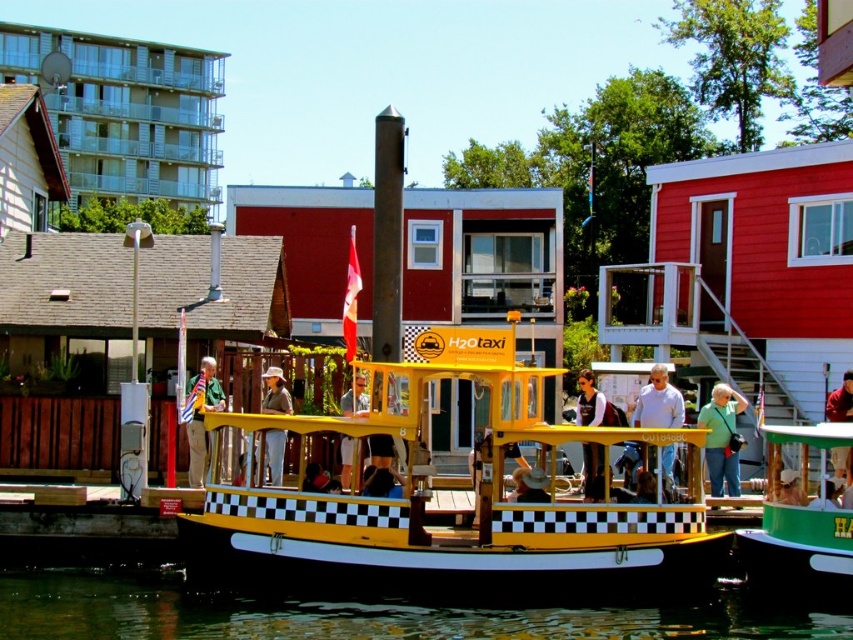
Does transparent water at lower center have a larger size compared to green fabric shirt at center?

Yes, transparent water at lower center is bigger than green fabric shirt at center.

Which is more to the right, transparent water at lower center or green fabric shirt at center?

transparent water at lower center

Is point (154, 580) closer to viewer compared to point (206, 440)?

Yes.

Locate an element on the screen. The height and width of the screenshot is (640, 853). transparent water at lower center is located at coordinates (351, 614).

Consider the image. Is green fabric shirt at center positioned behind matte black jacket at center?

Yes, it is behind matte black jacket at center.

Measure the distance between point (204, 449) and camera.

Point (204, 449) and camera are 150.28 feet apart.

Is point (201, 477) farther from camera compared to point (592, 372)?

That is False.

This screenshot has height=640, width=853. Identify the location of green fabric shirt at center. (201, 417).

Locate an element on the screen. This screenshot has width=853, height=640. transparent water at lower center is located at coordinates (351, 614).

Describe the element at coordinates (351, 614) in the screenshot. I see `transparent water at lower center` at that location.

The image size is (853, 640). In order to click on transparent water at lower center in this screenshot , I will do `click(351, 614)`.